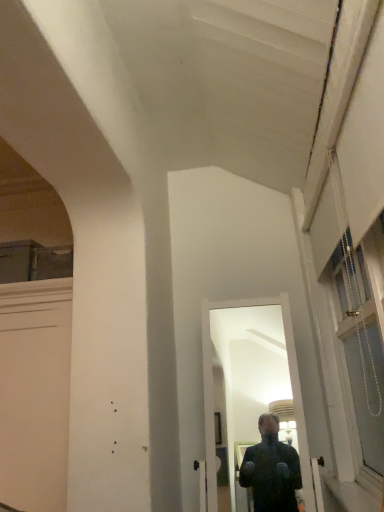
What are the coordinates of `clear glass mirror at center` in the screenshot? It's located at (213, 396).

In order to face clear glass mirror at center, should I rotate leftwards or rightwards?

A 7.379 degree turn to the right will do.

This screenshot has width=384, height=512. What do you see at coordinates (213, 396) in the screenshot?
I see `clear glass mirror at center` at bounding box center [213, 396].

I want to click on clear glass mirror at center, so click(x=213, y=396).